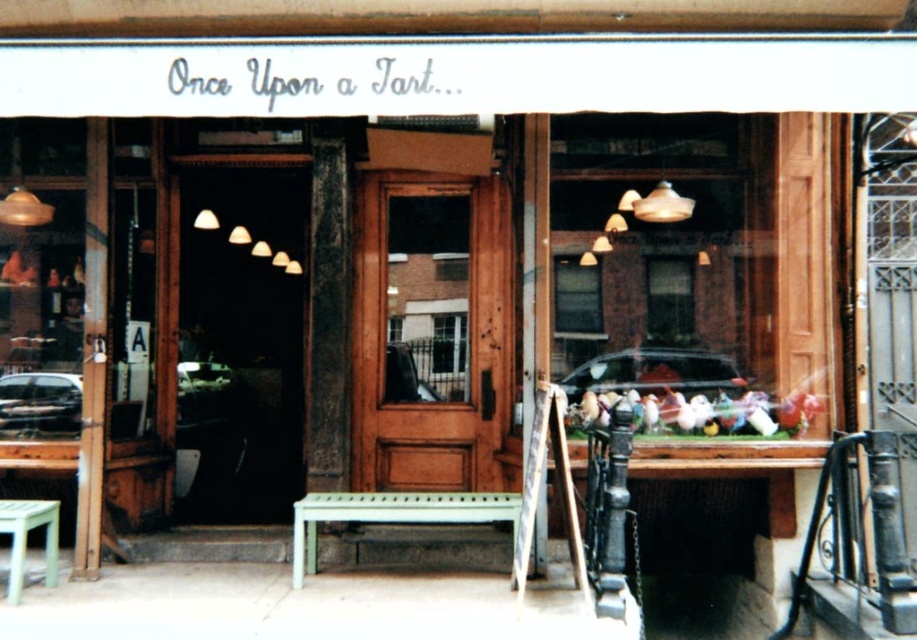
The width and height of the screenshot is (917, 640). Identify the location of wooden door at center. (431, 333).

Between point (485, 269) and point (15, 541), which one is positioned behind?

The point (485, 269) is more distant.

Where is `wooden door at center`? The width and height of the screenshot is (917, 640). wooden door at center is located at coordinates (431, 333).

Does green painted wood bench at center lie behind green matte stool at lower left?

Yes.

Between green painted wood bench at center and green matte stool at lower left, which one is positioned higher?

green painted wood bench at center is higher up.

Is point (330, 500) less distant than point (3, 513)?

No.

Identify the location of green painted wood bench at center. (392, 515).

Can you confirm if wooden door at center is thinner than matte wooden door at center?

Correct, wooden door at center's width is less than matte wooden door at center's.

Is wooden door at center positioned in front of matte wooden door at center?

Yes, it is.

Which is in front, point (451, 308) or point (192, 273)?

Point (451, 308)

Locate an element on the screen. wooden door at center is located at coordinates (431, 333).